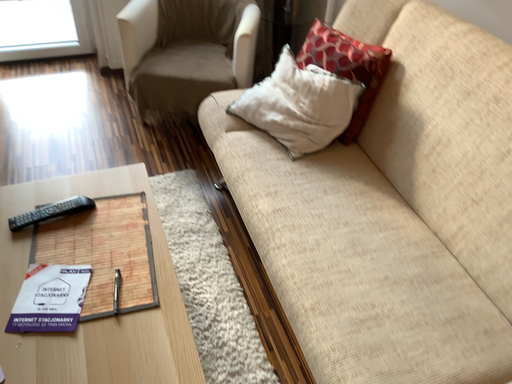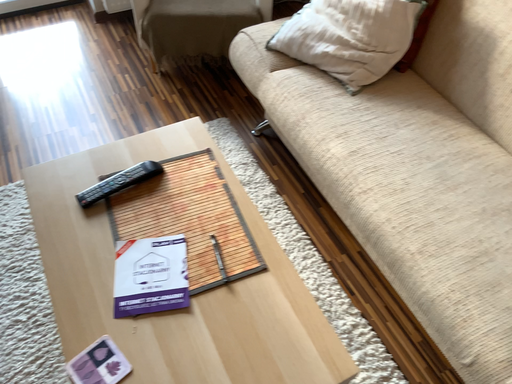
Question: How did the camera likely rotate when shooting the video?

Choices:
 (A) rotated upward
 (B) rotated downward

Answer: (B)